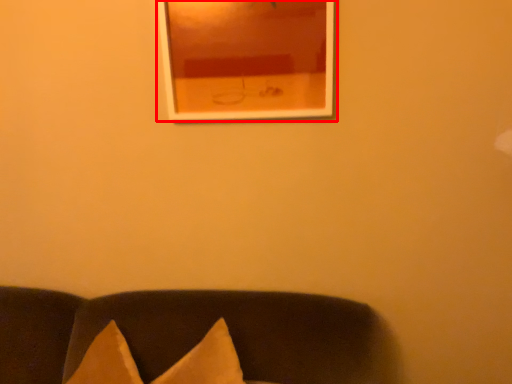
Question: From the image's perspective, where is picture frame (annotated by the red box) located in relation to furniture in the image?

Choices:
 (A) above
 (B) below

Answer: (A)